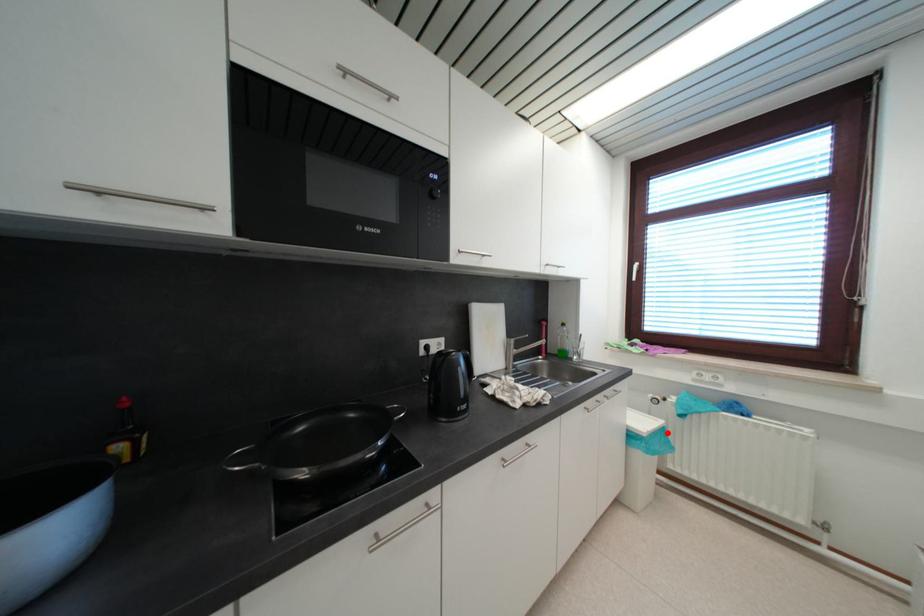
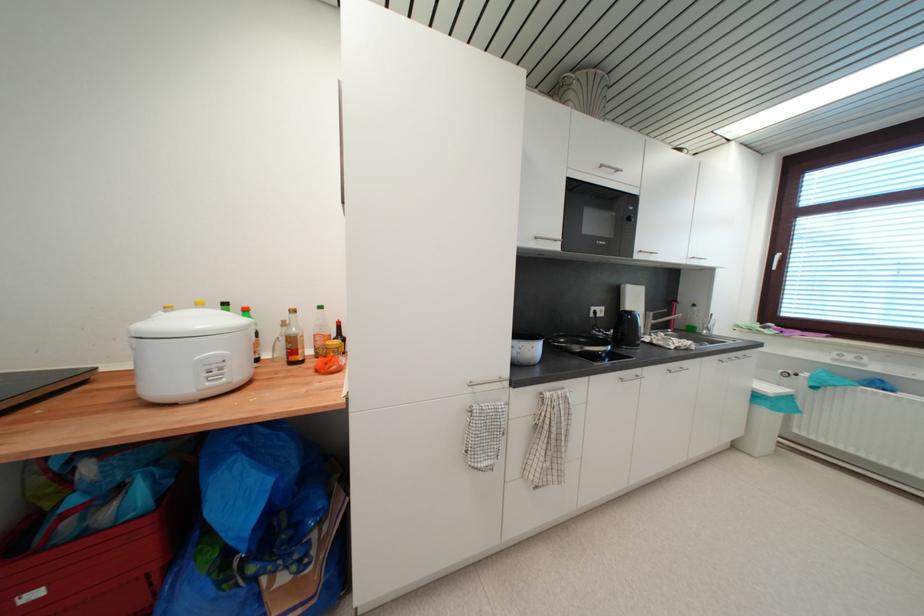
Question: I am providing you with two images of the same scene from different viewpoints. A red point is marked on the first image. Is the red point's position out of view in image 2?

Choices:
 (A) Yes
 (B) No

Answer: (B)